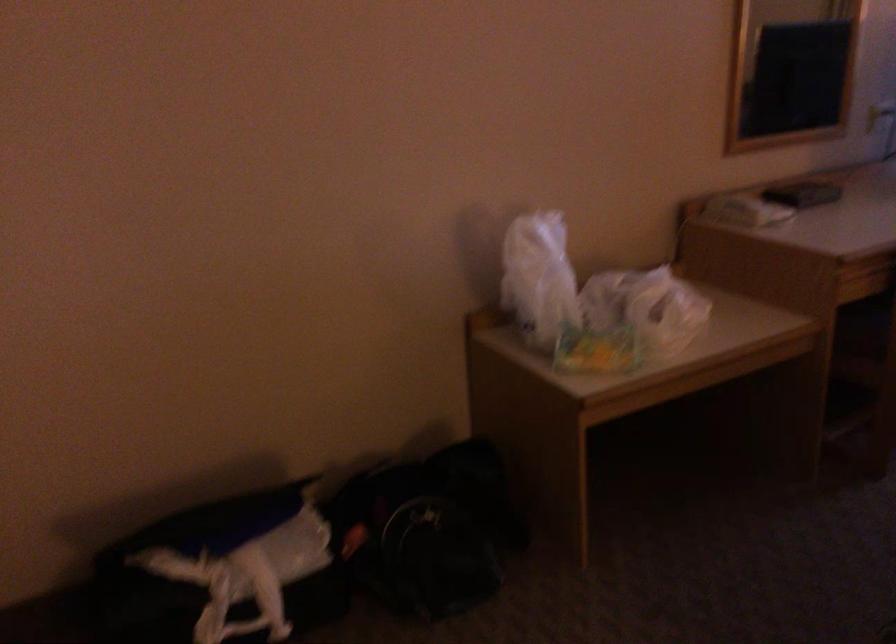
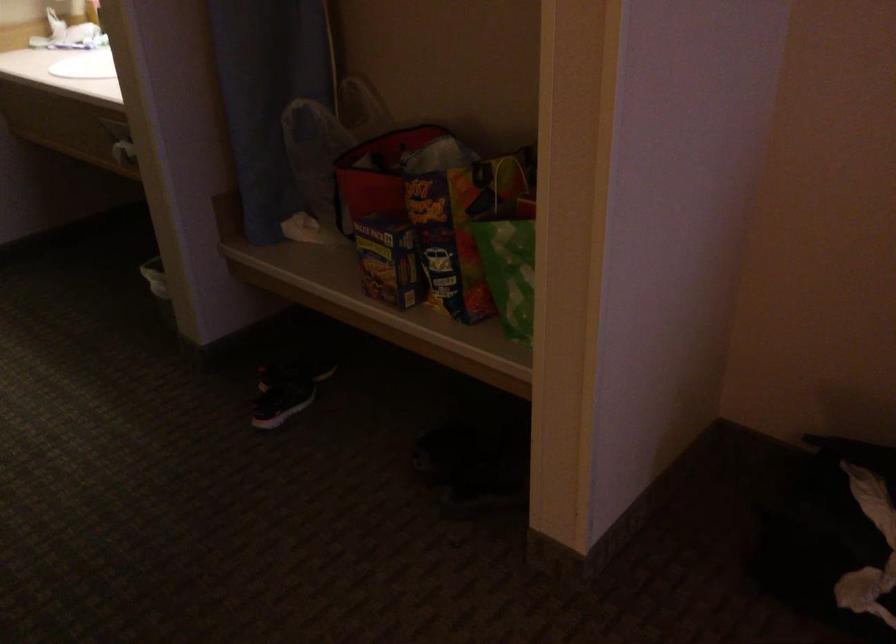
The images are taken continuously from a first-person perspective. In which direction is your viewpoint rotating?

The camera's rotation is toward left-down.